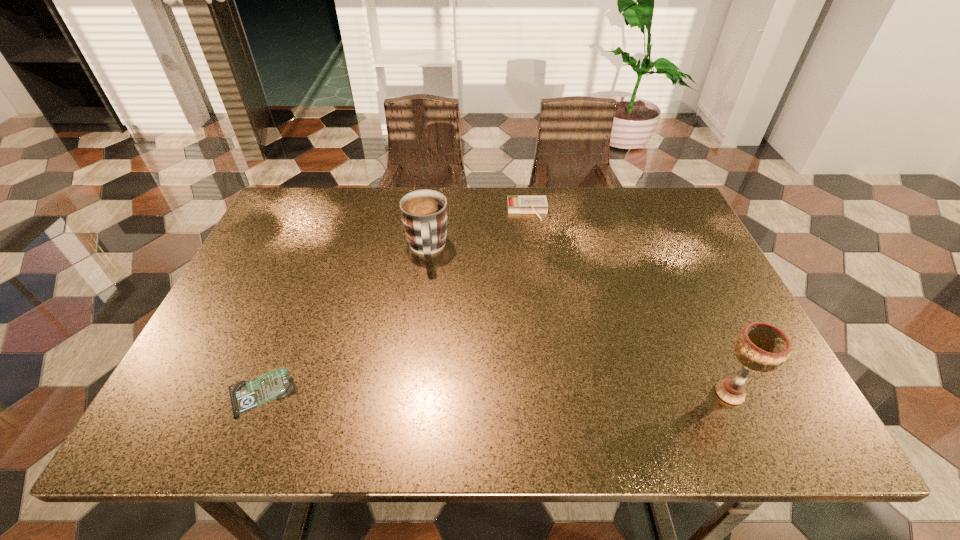
Where is `vacant area that lies between the farthest object and the leftmost object`? Image resolution: width=960 pixels, height=540 pixels. vacant area that lies between the farthest object and the leftmost object is located at coordinates (395, 302).

The height and width of the screenshot is (540, 960). What are the coordinates of `empty location between the rightmost object and the third nearest object` in the screenshot? It's located at (578, 321).

Find the location of a particular element. This screenshot has width=960, height=540. free area in between the rightmost object and the shortest object is located at coordinates (495, 393).

Find the location of `vacant area that lies between the mug and the matchbox`. vacant area that lies between the mug and the matchbox is located at coordinates (477, 230).

Find the location of a particular element. The height and width of the screenshot is (540, 960). vacant area between the chalice and the shortest object is located at coordinates (495, 393).

You are a GUI agent. You are given a task and a screenshot of the screen. Output one action in this format:
    pyautogui.click(x=<x>, y=<y>)
    Task: Click on the empty space that is in between the third shortest object and the identity card
    The height and width of the screenshot is (540, 960).
    Given the screenshot: What is the action you would take?
    pyautogui.click(x=345, y=320)

This screenshot has height=540, width=960. I want to click on vacant space that's between the identity card and the rightmost object, so click(x=495, y=393).

The width and height of the screenshot is (960, 540). In order to click on vacant region between the chalice and the farthest object in this screenshot , I will do `click(629, 302)`.

Where is `free point between the third shortest object and the rightmost object`? free point between the third shortest object and the rightmost object is located at coordinates (578, 321).

I want to click on free space between the rightmost object and the second object from left to right, so click(578, 321).